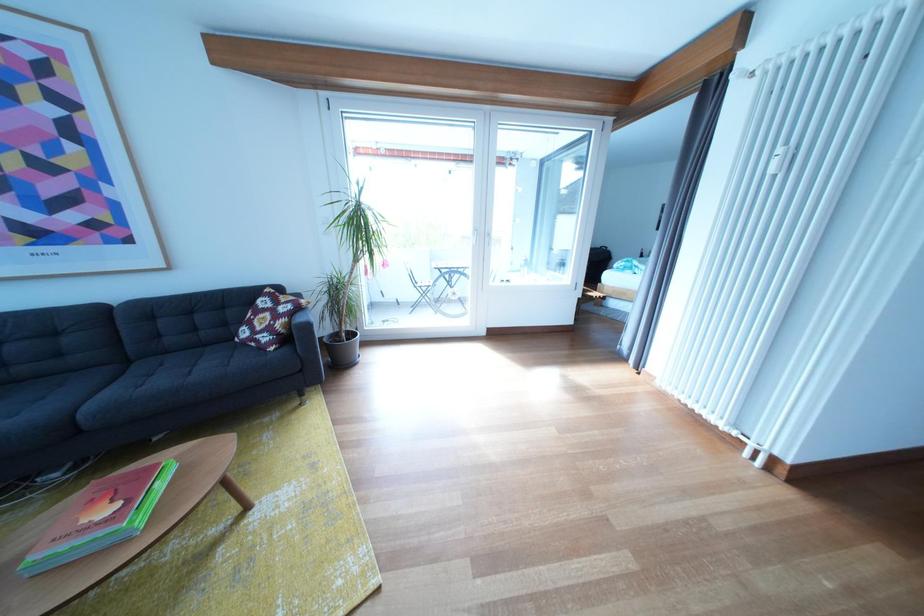
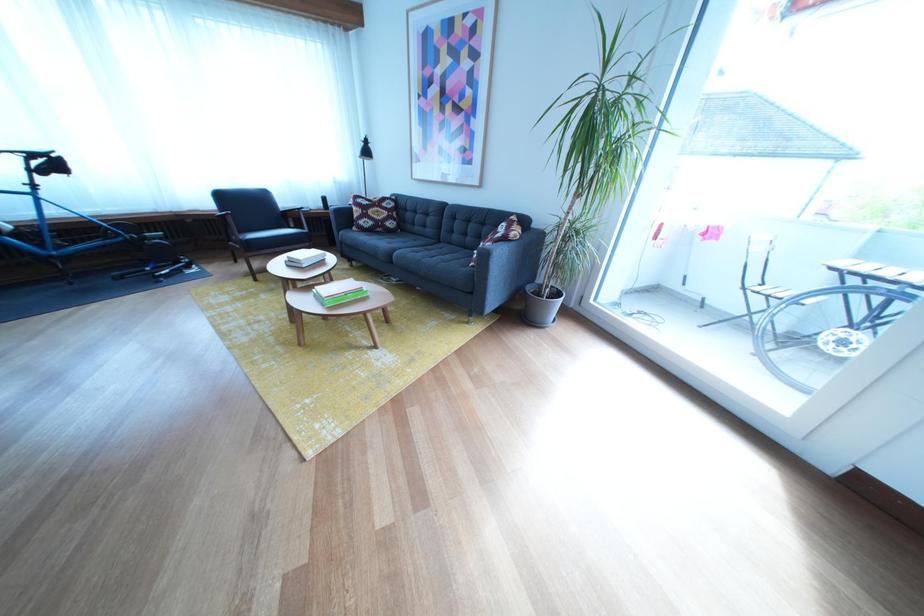
The point at (216, 339) is marked in the first image. Where is the corresponding point in the second image?

(481, 245)